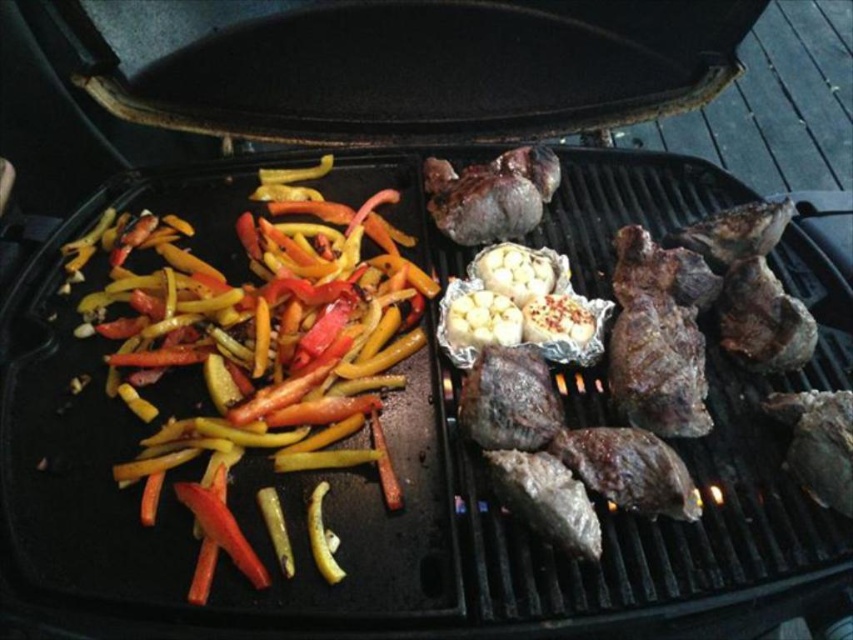
Question: Does shiny yellow-green bell peppers at left appear under charred brown meat at right?

Choices:
 (A) yes
 (B) no

Answer: (A)

Question: Among these objects, which one is farthest from the camera?

Choices:
 (A) shiny yellow-green bell peppers at left
 (B) charred brown meat at right

Answer: (B)

Question: Which point is farther from the camera taking this photo?

Choices:
 (A) (651, 250)
 (B) (115, 337)

Answer: (A)

Question: Where is shiny yellow-green bell peppers at left located in relation to charred brown meat at right in the image?

Choices:
 (A) below
 (B) above

Answer: (A)

Question: Is shiny yellow-green bell peppers at left below charred brown meat at right?

Choices:
 (A) no
 (B) yes

Answer: (B)